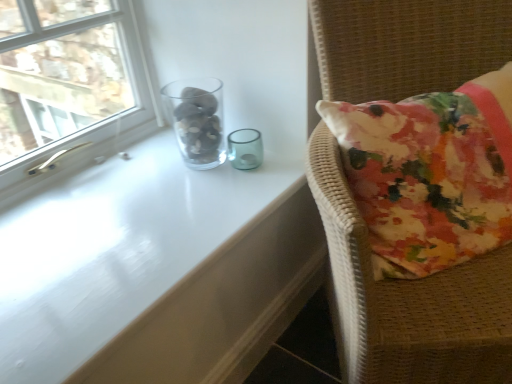
Question: Is clear glass window at upper left located within floral fabric cushion at right?

Choices:
 (A) yes
 (B) no

Answer: (B)

Question: Does floral fabric cushion at right have a lesser height compared to clear glass window at upper left?

Choices:
 (A) no
 (B) yes

Answer: (A)

Question: Does floral fabric cushion at right have a smaller size compared to clear glass window at upper left?

Choices:
 (A) no
 (B) yes

Answer: (A)

Question: Is floral fabric cushion at right positioned far away from clear glass window at upper left?

Choices:
 (A) yes
 (B) no

Answer: (A)

Question: Is floral fabric cushion at right located outside clear glass window at upper left?

Choices:
 (A) yes
 (B) no

Answer: (A)

Question: Is floral fabric cushion at right facing towards clear glass window at upper left?

Choices:
 (A) no
 (B) yes

Answer: (A)

Question: From the image's perspective, is transparent glass table at upper center under clear glass window at upper left?

Choices:
 (A) yes
 (B) no

Answer: (A)

Question: Is transparent glass table at upper center outside clear glass window at upper left?

Choices:
 (A) no
 (B) yes

Answer: (B)

Question: Does transparent glass table at upper center have a lesser width compared to clear glass window at upper left?

Choices:
 (A) no
 (B) yes

Answer: (A)

Question: Is transparent glass table at upper center positioned in front of clear glass window at upper left?

Choices:
 (A) no
 (B) yes

Answer: (B)

Question: Is transparent glass table at upper center shorter than clear glass window at upper left?

Choices:
 (A) no
 (B) yes

Answer: (B)

Question: Is transparent glass table at upper center next to clear glass window at upper left?

Choices:
 (A) no
 (B) yes

Answer: (A)

Question: Can we say floral fabric cushion at right lies outside transparent glass table at upper center?

Choices:
 (A) no
 (B) yes

Answer: (B)